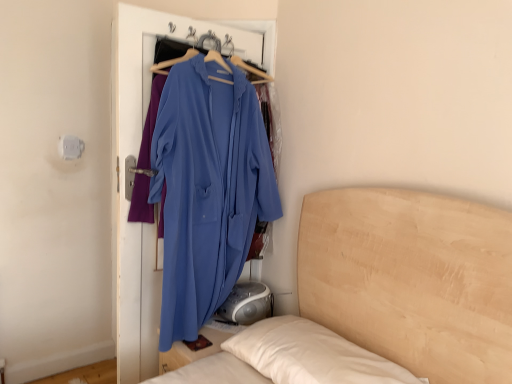
The height and width of the screenshot is (384, 512). Find the location of `wooden bed at center`. wooden bed at center is located at coordinates (411, 279).

Describe the element at coordinates (411, 279) in the screenshot. This screenshot has height=384, width=512. I see `wooden bed at center` at that location.

Measure the distance between wooden bed at center and camera.

wooden bed at center and camera are 4.05 feet apart from each other.

I want to click on matte blue robe at center, so click(207, 189).

The height and width of the screenshot is (384, 512). Describe the element at coordinates (207, 189) in the screenshot. I see `matte blue robe at center` at that location.

Locate an element on the screen. wooden bed at center is located at coordinates (411, 279).

Is wooden bed at center to the left of matte blue robe at center from the viewer's perspective?

No, wooden bed at center is not to the left of matte blue robe at center.

Which object is further away from the camera, wooden bed at center or matte blue robe at center?

matte blue robe at center is more distant.

Does point (462, 351) appear closer or farther from the camera than point (169, 91)?

Point (462, 351).

From the image's perspective, is wooden bed at center located above matte blue robe at center?

No, from the image's perspective, wooden bed at center is not above matte blue robe at center.

From a real-world perspective, which is physically below, wooden bed at center or matte blue robe at center?

From a 3D spatial view, wooden bed at center is below.

Can you confirm if wooden bed at center is wider than matte blue robe at center?

Yes, wooden bed at center is wider than matte blue robe at center.

Considering the sizes of objects wooden bed at center and matte blue robe at center in the image provided, who is shorter, wooden bed at center or matte blue robe at center?

wooden bed at center.

Who is smaller, wooden bed at center or matte blue robe at center?

With smaller size is matte blue robe at center.

Is wooden bed at center not inside matte blue robe at center?

wooden bed at center lies outside matte blue robe at center's area.

Is wooden bed at center touching matte blue robe at center?

No, wooden bed at center is not beside matte blue robe at center.

Is matte blue robe at center at the back of wooden bed at center?

That's not correct — wooden bed at center is not looking away from matte blue robe at center.

The width and height of the screenshot is (512, 384). I want to click on fancy dress behind the wooden bed at center, so click(207, 189).

Is matte blue robe at center at the right side of wooden bed at center?

Incorrect, matte blue robe at center is not on the right side of wooden bed at center.

Which is behind, matte blue robe at center or wooden bed at center?

matte blue robe at center.

Which is nearer, (264,177) or (497,292)?

The point (497,292) is in front.

From the image's perspective, which one is positioned higher, matte blue robe at center or wooden bed at center?

matte blue robe at center is shown above in the image.

From a real-world perspective, relative to wooden bed at center, is matte blue robe at center vertically above or below?

matte blue robe at center is above wooden bed at center.

Does matte blue robe at center have a greater width compared to wooden bed at center?

No.

Is matte blue robe at center taller or shorter than wooden bed at center?

Clearly, matte blue robe at center is taller compared to wooden bed at center.

Which of these two, matte blue robe at center or wooden bed at center, is smaller?

With smaller size is matte blue robe at center.

In the scene shown: Is matte blue robe at center situated inside wooden bed at center or outside?

matte blue robe at center lies outside wooden bed at center.

Is matte blue robe at center beside wooden bed at center?

They are not placed beside each other.

Is matte blue robe at center turned away from wooden bed at center?

No, matte blue robe at center is not facing away from wooden bed at center.

Can you tell me how much matte blue robe at center and wooden bed at center differ in facing direction?

The facing directions of matte blue robe at center and wooden bed at center are 90.4 degrees apart.

This screenshot has width=512, height=384. What are the coordinates of `fancy dress behind the wooden bed at center` in the screenshot? It's located at (207, 189).

Where is `bed on the right of matte blue robe at center`? The image size is (512, 384). bed on the right of matte blue robe at center is located at coordinates 411,279.

In order to click on bed that is below the matte blue robe at center (from the image's perspective) in this screenshot , I will do `click(411, 279)`.